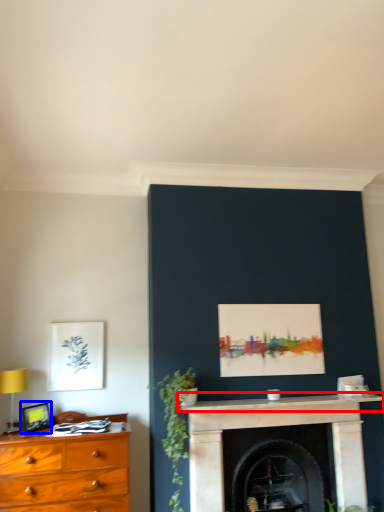
Question: Which object appears farthest to the camera in this image, mantle (highlighted by a red box) or picture frame (highlighted by a blue box)?

Choices:
 (A) mantle
 (B) picture frame

Answer: (B)